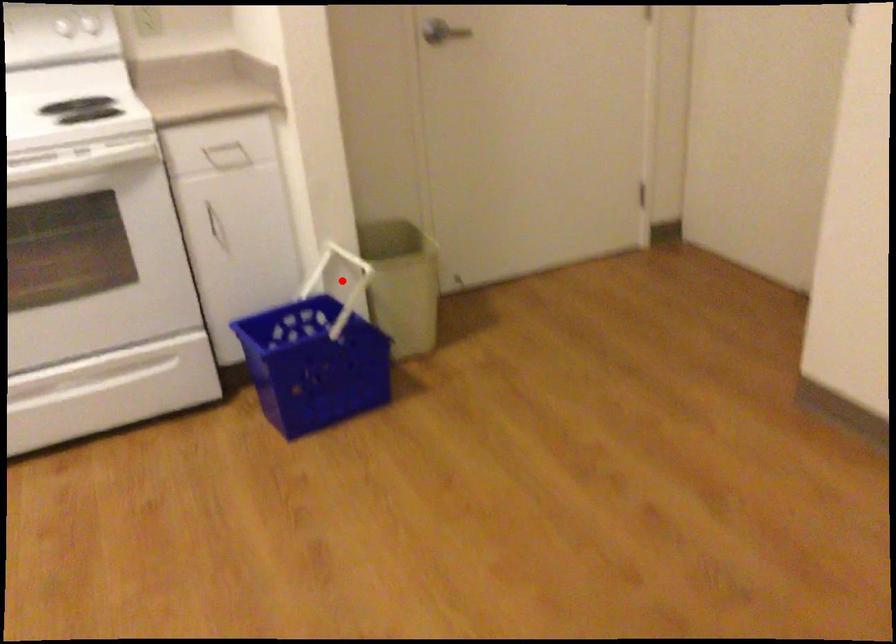
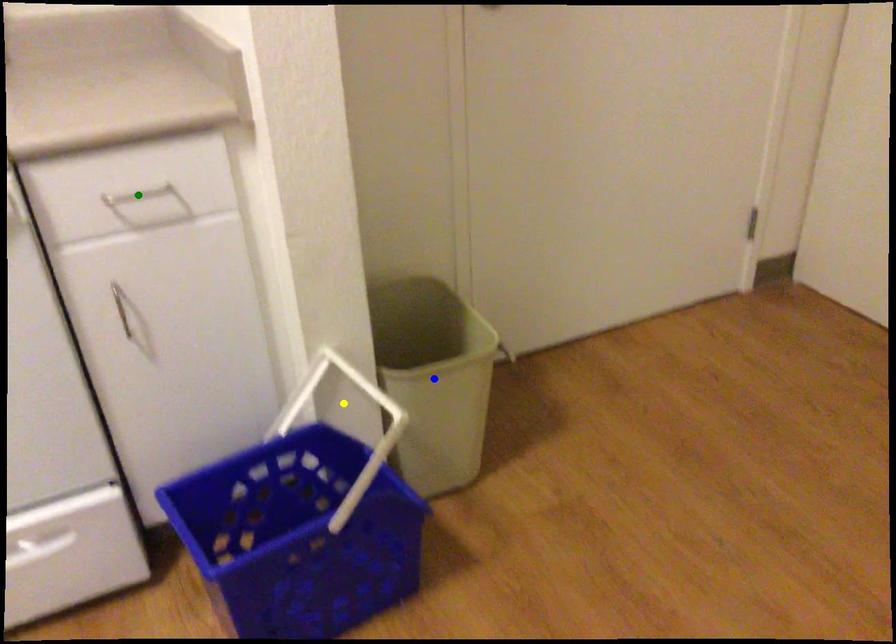
Question: I am providing you with two images of the same scene from different viewpoints. A red point is marked on the first image. You are given multiple points on the second image. Which mark in image 2 goes with the point in image 1?

Choices:
 (A) blue point
 (B) green point
 (C) yellow point

Answer: (C)